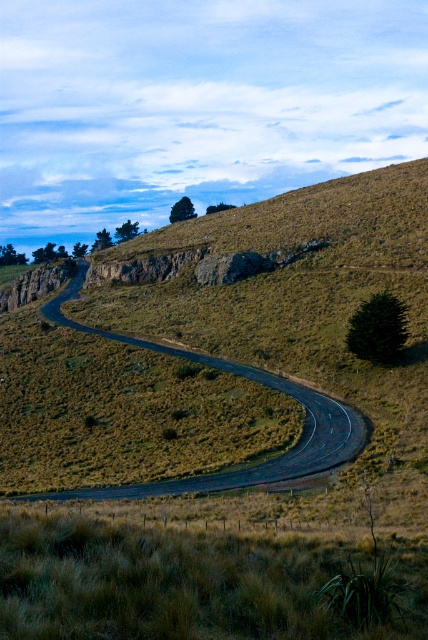
Is point (350, 550) farther from camera compared to point (256, 378)?

No, it is in front of (256, 378).

Does dry grass at lower left have a larger size compared to black asphalt road at center?

No.

The image size is (428, 640). What do you see at coordinates (186, 582) in the screenshot?
I see `dry grass at lower left` at bounding box center [186, 582].

Identify the location of dry grass at lower left. (186, 582).